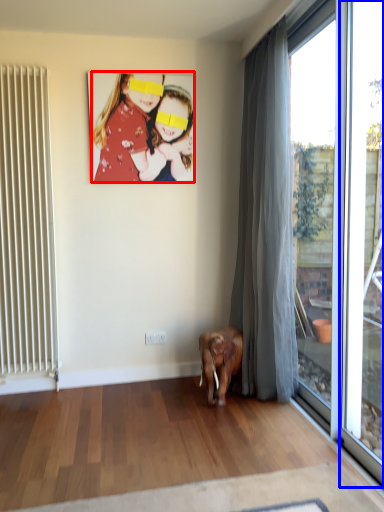
Question: Which of the following is the closest to the observer, person (highlighted by a red box) or window frame (highlighted by a blue box)?

Choices:
 (A) person
 (B) window frame

Answer: (B)